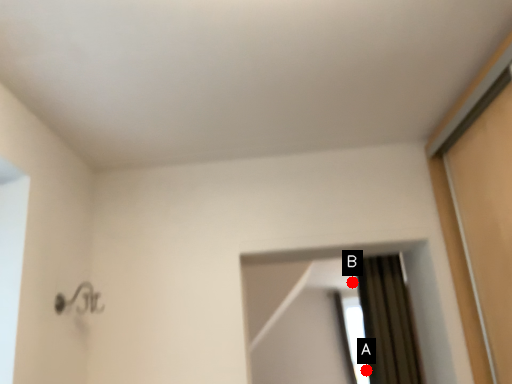
Question: Two points are circled on the image, labeled by A and B beside each circle. Among these points, which one is farthest from the camera?

Choices:
 (A) A is further
 (B) B is further

Answer: (B)